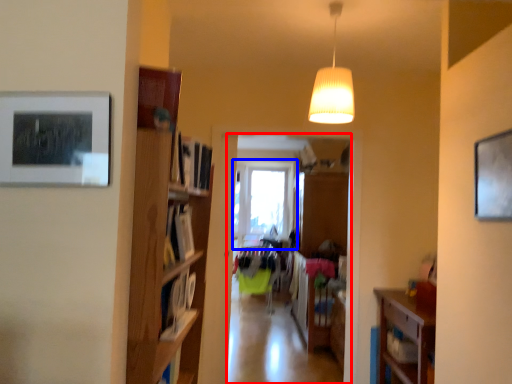
Question: Among these objects, which one is farthest to the camera, clothing store (highlighted by a red box) or window (highlighted by a blue box)?

Choices:
 (A) clothing store
 (B) window

Answer: (B)